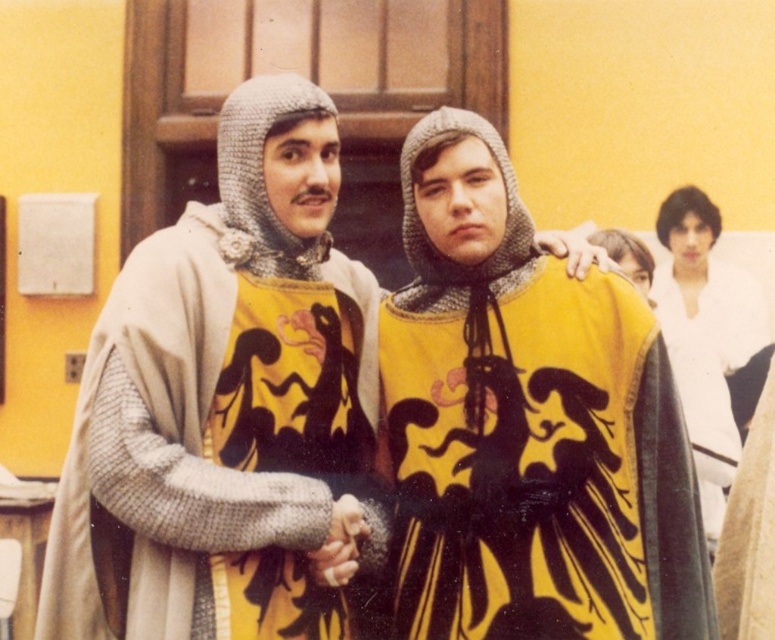
Looking at this image, does yellow fabric cape at center appear on the right side of knitted wool robe at center?

Indeed, yellow fabric cape at center is positioned on the right side of knitted wool robe at center.

Is point (467, 397) behind point (186, 422)?

Yes, point (467, 397) is farther from viewer.

Does point (629, 556) come closer to viewer compared to point (102, 356)?

That is False.

Where is `yellow fabric cape at center`? yellow fabric cape at center is located at coordinates (527, 424).

Does yellow fabric cape at center come behind white matte shirt at upper right?

No, yellow fabric cape at center is in front of white matte shirt at upper right.

Which is more to the left, yellow fabric cape at center or white matte shirt at upper right?

yellow fabric cape at center

In order to click on yellow fabric cape at center in this screenshot , I will do `click(527, 424)`.

Locate an element on the screen. This screenshot has width=775, height=640. yellow fabric cape at center is located at coordinates (527, 424).

Can you confirm if knitted wool robe at center is positioned to the right of white matte shirt at upper right?

Incorrect, knitted wool robe at center is not on the right side of white matte shirt at upper right.

Who is more forward, (219, 333) or (663, 268)?

Point (219, 333)

This screenshot has width=775, height=640. Find the location of `knitted wool robe at center`. knitted wool robe at center is located at coordinates (140, 390).